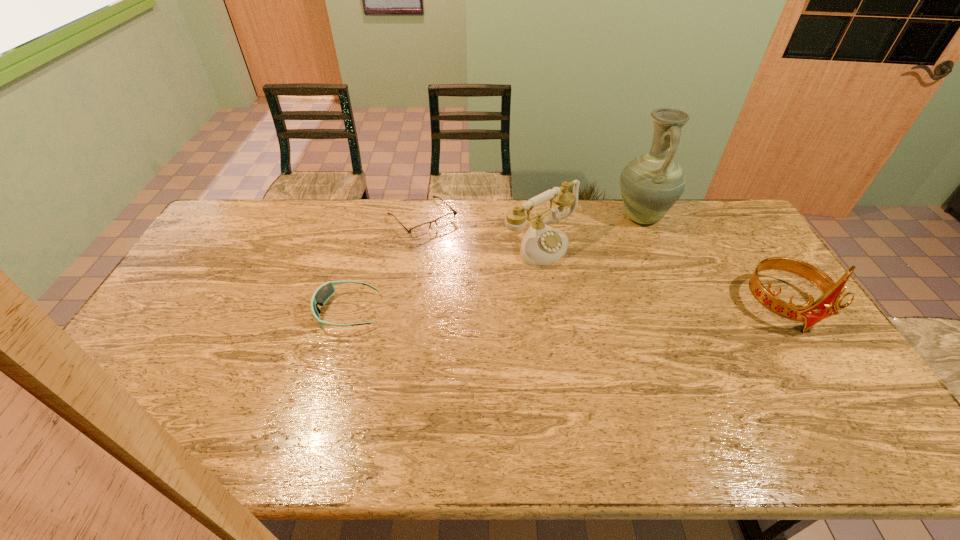
Locate an element on the screen. Image resolution: width=960 pixels, height=540 pixels. free space located on the front-facing side of the goggles is located at coordinates (246, 311).

Image resolution: width=960 pixels, height=540 pixels. I want to click on vacant space located 0.100m on the front-facing side of the tiara, so click(826, 369).

Where is `vacant space located on the dial of the telephone`? The height and width of the screenshot is (540, 960). vacant space located on the dial of the telephone is located at coordinates (578, 268).

Locate an element on the screen. This screenshot has height=540, width=960. free space located 0.340m on the dial of the telephone is located at coordinates (652, 322).

The image size is (960, 540). Find the location of `free space located 0.130m on the dial of the telephone`. free space located 0.130m on the dial of the telephone is located at coordinates (596, 282).

Locate an element on the screen. blank space located 0.100m on the front-facing side of the spectacles is located at coordinates (455, 252).

At what (x,y) coordinates should I click in order to perform the action: click on vacant space located 0.340m on the front-facing side of the spectacles. Please return your answer as a coordinate pair (x, y). Looking at the image, I should click on (495, 295).

Identify the location of free space located 0.260m on the front-facing side of the spectacles. The height and width of the screenshot is (540, 960). (481, 280).

Image resolution: width=960 pixels, height=540 pixels. I want to click on vacant space located 0.190m on the handle side of the tallest object, so click(622, 266).

What are the coordinates of `vacant space located 0.300m on the handle side of the tallest object` in the screenshot? It's located at (614, 287).